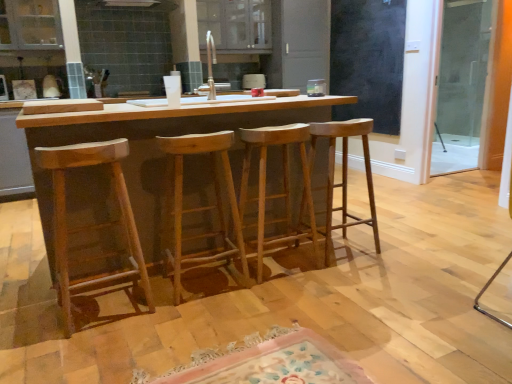
Locate an element on the screen. This screenshot has height=384, width=512. vacant space in between natural wood stool at left, the 1th stool in the left-to-right sequence, and natural wood stool at center, placed as the 2th stool when sorted from left to right is located at coordinates (161, 301).